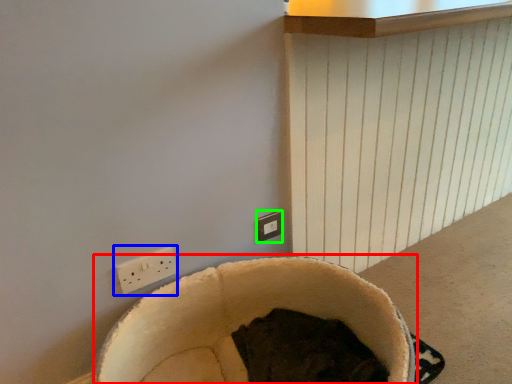
Question: Estimate the real-world distances between objects in this image. Which object is closer to bean bag chair (highlighted by a red box), power plugs and sockets (highlighted by a blue box) or electric outlet (highlighted by a green box)?

Choices:
 (A) power plugs and sockets
 (B) electric outlet

Answer: (A)